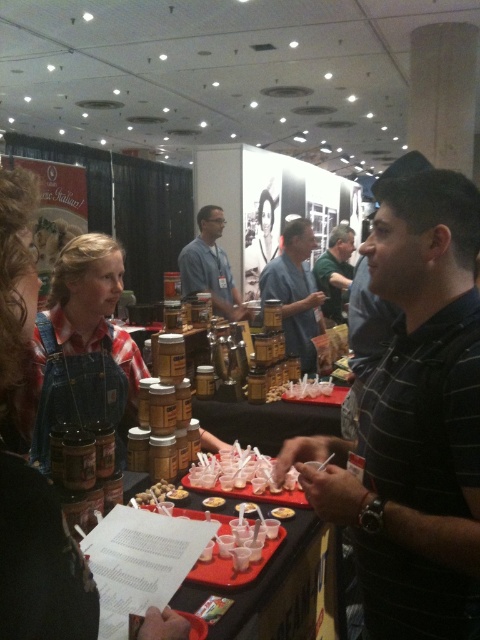
Question: Does green fabric shirt at center have a lesser width compared to matte brown jar at center?

Choices:
 (A) yes
 (B) no

Answer: (B)

Question: Estimate the real-world distances between objects in this image. Which object is farther from the brown matte nuts at center?

Choices:
 (A) matte brown jar at center
 (B) matte brown canister at center

Answer: (B)

Question: Can you confirm if blue shirt at center is positioned to the right of translucent plastic cup at center?

Choices:
 (A) yes
 (B) no

Answer: (B)

Question: Can you confirm if black striped shirt at right is positioned to the right of yellow matte jar at center?

Choices:
 (A) no
 (B) yes

Answer: (B)

Question: Which object is closer to the camera taking this photo?

Choices:
 (A) translucent plastic cups at center
 (B) yellow matte jar at center

Answer: (B)

Question: Estimate the real-world distances between objects in this image. Which object is closer to the matte brown canister at center?

Choices:
 (A) translucent plastic cups at center
 (B) green fabric shirt at center
 (C) translucent plastic cup at center
 (D) brown matte nuts at center

Answer: (B)